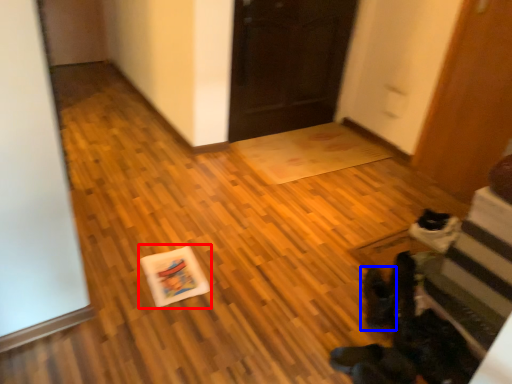
Question: Which object appears closest to the camera in this image, postcard (highlighted by a red box) or footwear (highlighted by a blue box)?

Choices:
 (A) postcard
 (B) footwear

Answer: (B)